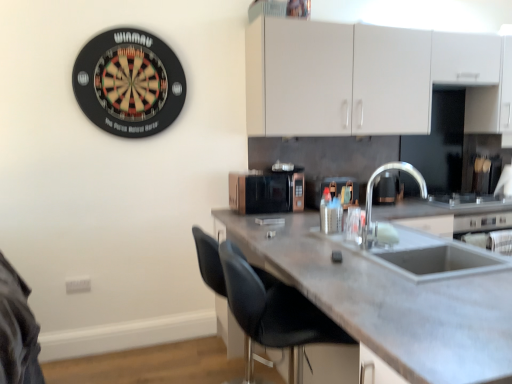
Question: Does metallic silver container at center, positioned as the 1th appliance in right-to-left order, have a lesser width compared to rose gold metallic microwave at center, the 1th appliance in the left-to-right sequence?

Choices:
 (A) yes
 (B) no

Answer: (B)

Question: Is metallic silver container at center, which is counted as the 2th appliance, starting from the left, looking in the opposite direction of rose gold metallic microwave at center, the 1th appliance in the left-to-right sequence?

Choices:
 (A) no
 (B) yes

Answer: (A)

Question: From a real-world perspective, is metallic silver container at center, positioned as the 1th appliance in right-to-left order, positioned over rose gold metallic microwave at center, which is the 2th appliance in right-to-left order, based on gravity?

Choices:
 (A) no
 (B) yes

Answer: (A)

Question: Is metallic silver container at center, positioned as the 1th appliance in right-to-left order, closer to camera compared to rose gold metallic microwave at center, the 1th appliance in the left-to-right sequence?

Choices:
 (A) yes
 (B) no

Answer: (B)

Question: Is metallic silver container at center, which is counted as the 2th appliance, starting from the left, to the left of rose gold metallic microwave at center, which is the 2th appliance in right-to-left order, from the viewer's perspective?

Choices:
 (A) yes
 (B) no

Answer: (B)

Question: Is point (293, 170) positioned closer to the camera than point (273, 286)?

Choices:
 (A) closer
 (B) farther

Answer: (B)

Question: Looking at the image, does rose gold metallic microwave at center, which is the 2th appliance in right-to-left order, seem bigger or smaller compared to black leather chair at lower center?

Choices:
 (A) big
 (B) small

Answer: (B)

Question: From a real-world perspective, is rose gold metallic microwave at center, the 1th appliance in the left-to-right sequence, above or below black leather chair at lower center?

Choices:
 (A) below
 (B) above

Answer: (B)

Question: Is rose gold metallic microwave at center, the 1th appliance in the left-to-right sequence, taller or shorter than black leather chair at lower center?

Choices:
 (A) short
 (B) tall

Answer: (A)

Question: In terms of width, does rose gold metallic microwave at center, the 1th appliance in the left-to-right sequence, look wider or thinner when compared to concrete gray countertop at center?

Choices:
 (A) wide
 (B) thin

Answer: (B)

Question: Is rose gold metallic microwave at center, which is the 2th appliance in right-to-left order, in front of or behind concrete gray countertop at center in the image?

Choices:
 (A) behind
 (B) front

Answer: (A)

Question: Looking at the image, does rose gold metallic microwave at center, which is the 2th appliance in right-to-left order, seem bigger or smaller compared to concrete gray countertop at center?

Choices:
 (A) small
 (B) big

Answer: (A)

Question: Is point (287, 196) closer or farther from the camera than point (412, 251)?

Choices:
 (A) closer
 (B) farther

Answer: (B)

Question: Is black leather chair at lower center to the left or to the right of concrete gray countertop at center in the image?

Choices:
 (A) left
 (B) right

Answer: (A)

Question: Considering their positions, is black leather chair at lower center located in front of or behind concrete gray countertop at center?

Choices:
 (A) front
 (B) behind

Answer: (B)